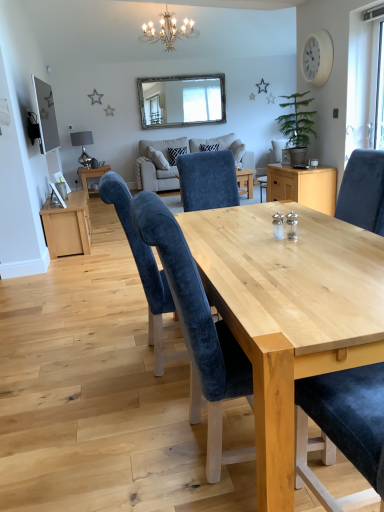
This screenshot has height=512, width=384. I want to click on vacant space situated on the left part of velvet blue chair at center, the 2th chair viewed from the back, so click(119, 442).